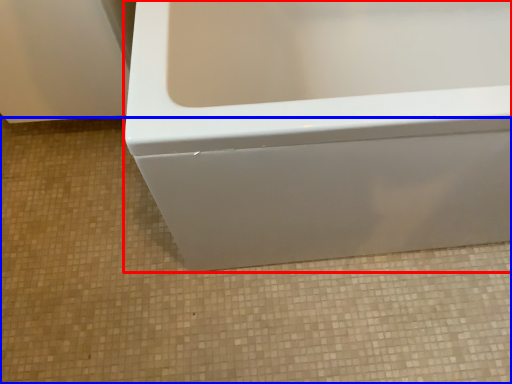
Question: Among these objects, which one is farthest to the camera, bathtub (highlighted by a red box) or ceramic tile (highlighted by a blue box)?

Choices:
 (A) bathtub
 (B) ceramic tile

Answer: (B)